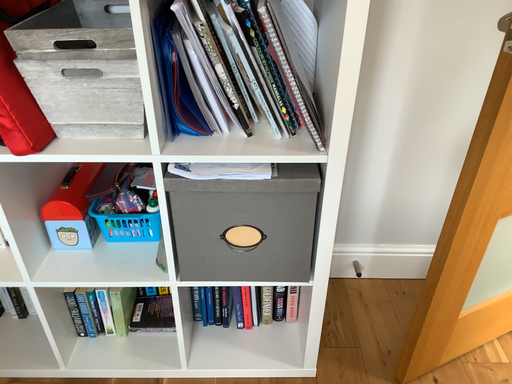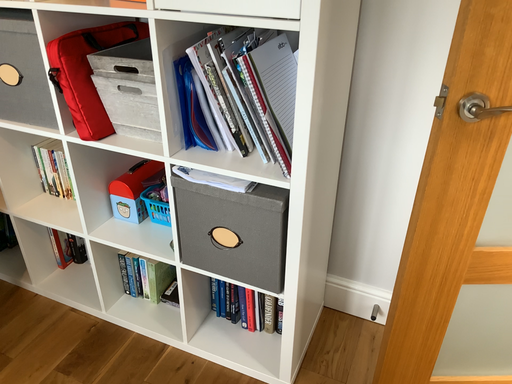
Question: Which way did the camera rotate in the video?

Choices:
 (A) rotated upward
 (B) rotated downward

Answer: (A)